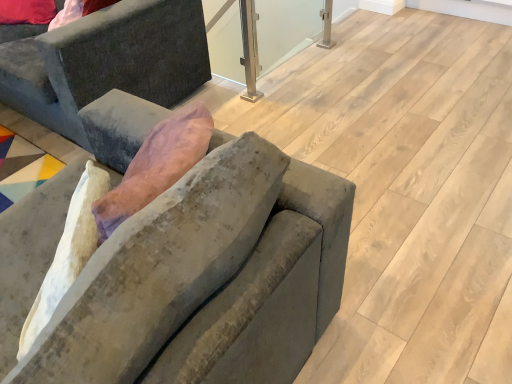
Question: Visually, is velvet gray couch at center, which appears as the first studio couch when viewed from the front, positioned to the left or to the right of velvet gray couch at left, acting as the second studio couch starting from the front?

Choices:
 (A) left
 (B) right

Answer: (B)

Question: Considering the positions of point (231, 352) and point (19, 102), is point (231, 352) closer or farther from the camera than point (19, 102)?

Choices:
 (A) farther
 (B) closer

Answer: (B)

Question: Which object is the farthest from the velvet gray couch at left, which appears as the first studio couch when viewed from the back?

Choices:
 (A) clear glass window screen at center
 (B) velvet gray couch at center, acting as the 1th studio couch starting from the bottom

Answer: (A)

Question: Estimate the real-world distances between objects in this image. Which object is closer to the clear glass window screen at center?

Choices:
 (A) velvet gray couch at center, positioned as the 2th studio couch in back-to-front order
 (B) velvet gray couch at left, the 1th studio couch when ordered from top to bottom

Answer: (B)